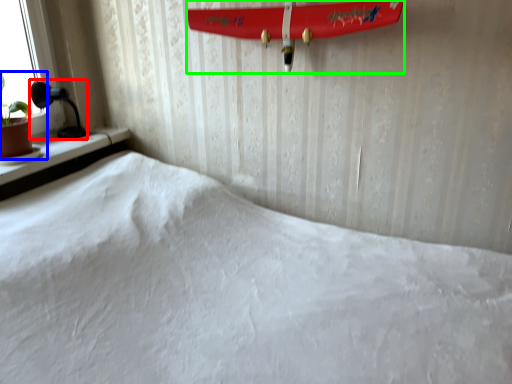
Question: Considering the real-world distances, which object is farthest from table lamp (highlighted by a red box)? houseplant (highlighted by a blue box) or surfboard (highlighted by a green box)?

Choices:
 (A) houseplant
 (B) surfboard

Answer: (B)